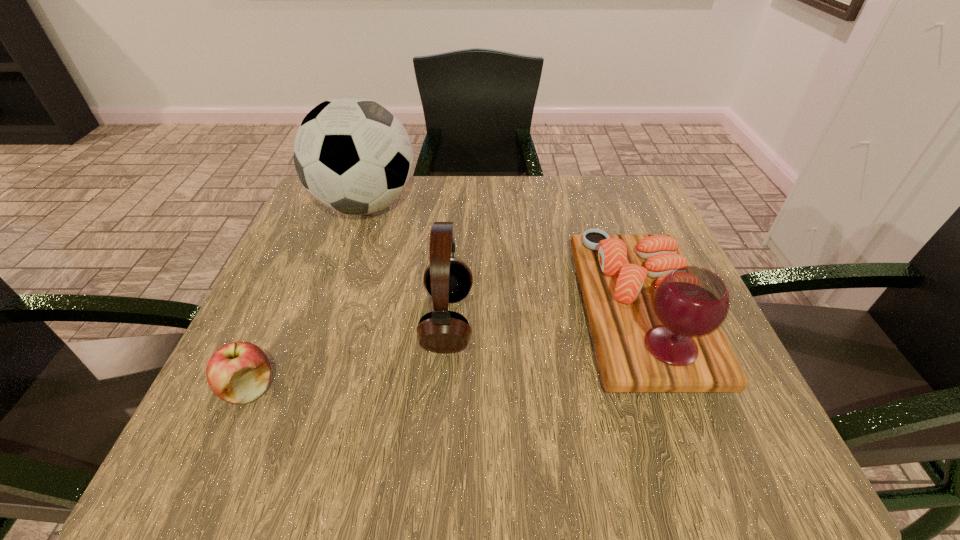
Where is `vacant space that's between the farthest object and the shortest object`? The image size is (960, 540). vacant space that's between the farthest object and the shortest object is located at coordinates (307, 297).

Locate an element on the screen. This screenshot has height=540, width=960. vacant area that lies between the tallest object and the shortest object is located at coordinates 307,297.

Identify the location of empty location between the headset and the rightmost object. The image size is (960, 540). (544, 317).

You are a GUI agent. You are given a task and a screenshot of the screen. Output one action in this format:
    pyautogui.click(x=<x>, y=<y>)
    Task: Click on the vacant area that lies between the tallest object and the headset
    
    Given the screenshot: What is the action you would take?
    pyautogui.click(x=406, y=264)

Locate an element on the screen. Image resolution: width=960 pixels, height=540 pixels. vacant area between the headset and the platter is located at coordinates (544, 317).

Image resolution: width=960 pixels, height=540 pixels. I want to click on free space between the headset and the rightmost object, so pos(544,317).

The height and width of the screenshot is (540, 960). Identify the location of vacant point located between the rightmost object and the headset. (544, 317).

Select which object appears as the second closest to the second object from right to left. Please provide its 2D coordinates. Your answer should be formatted as a tuple, i.e. [(x, y)], where the tuple contains the x and y coordinates of a point satisfying the conditions above.

[(655, 321)]

Identify the location of the closest object to the farthest object. The height and width of the screenshot is (540, 960). (448, 279).

I want to click on vacant region that satisfies the following two spatial constraints: 1. on the back side of the platter; 2. on the right side of the apple, so click(282, 312).